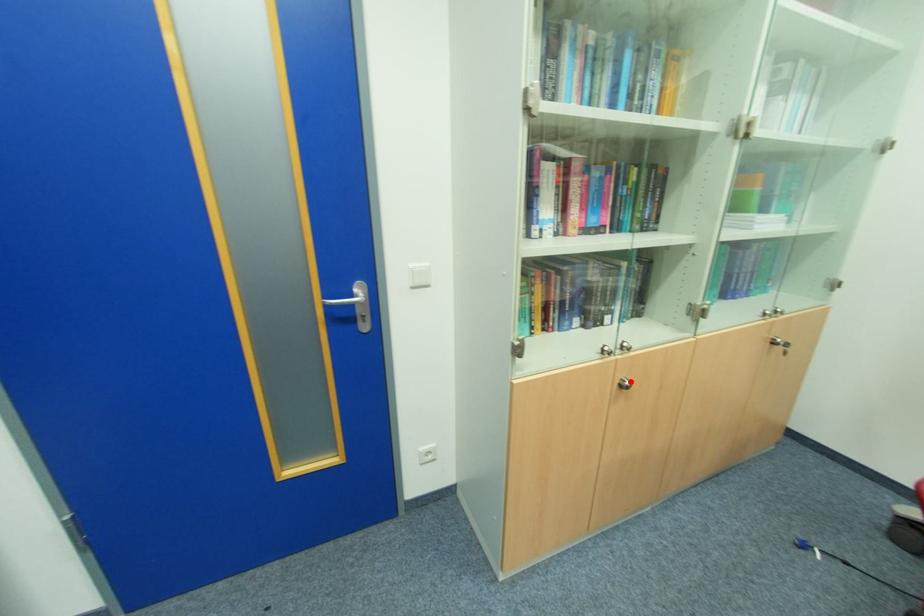
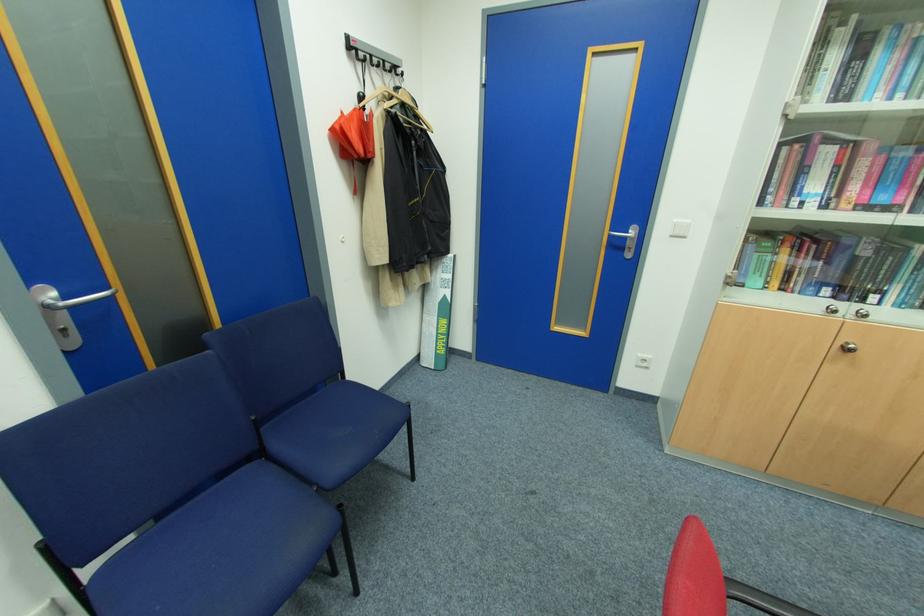
Question: I am providing you with two images of the same scene from different viewpoints. A red point is marked on the first image. Is the red point's position out of view in image 2?

Choices:
 (A) Yes
 (B) No

Answer: (B)